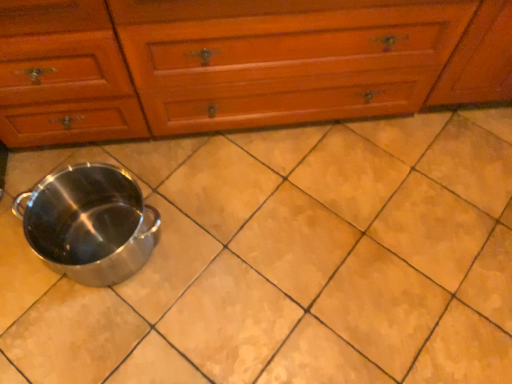
Question: Does satin silver crock pot at lower left turn towards wooden chest of drawers at center?

Choices:
 (A) no
 (B) yes

Answer: (A)

Question: Can you confirm if satin silver crock pot at lower left is taller than wooden chest of drawers at center?

Choices:
 (A) yes
 (B) no

Answer: (B)

Question: Is satin silver crock pot at lower left to the left of wooden chest of drawers at center from the viewer's perspective?

Choices:
 (A) no
 (B) yes

Answer: (B)

Question: Does satin silver crock pot at lower left have a smaller size compared to wooden chest of drawers at center?

Choices:
 (A) no
 (B) yes

Answer: (B)

Question: From a real-world perspective, does satin silver crock pot at lower left stand above wooden chest of drawers at center?

Choices:
 (A) no
 (B) yes

Answer: (A)

Question: Can you confirm if satin silver crock pot at lower left is shorter than wooden chest of drawers at center?

Choices:
 (A) yes
 (B) no

Answer: (A)

Question: Would you say wooden chest of drawers at center is part of matte ceramic tile at center's contents?

Choices:
 (A) yes
 (B) no

Answer: (B)

Question: Does matte ceramic tile at center have a lesser width compared to wooden chest of drawers at center?

Choices:
 (A) no
 (B) yes

Answer: (A)

Question: Is matte ceramic tile at center next to wooden chest of drawers at center?

Choices:
 (A) yes
 (B) no

Answer: (B)

Question: Can you confirm if matte ceramic tile at center is shorter than wooden chest of drawers at center?

Choices:
 (A) yes
 (B) no

Answer: (A)

Question: Does matte ceramic tile at center lie in front of wooden chest of drawers at center?

Choices:
 (A) no
 (B) yes

Answer: (A)

Question: Is matte ceramic tile at center wider than wooden chest of drawers at center?

Choices:
 (A) yes
 (B) no

Answer: (A)

Question: Would you say matte ceramic tile at center contains satin silver crock pot at lower left?

Choices:
 (A) no
 (B) yes

Answer: (A)